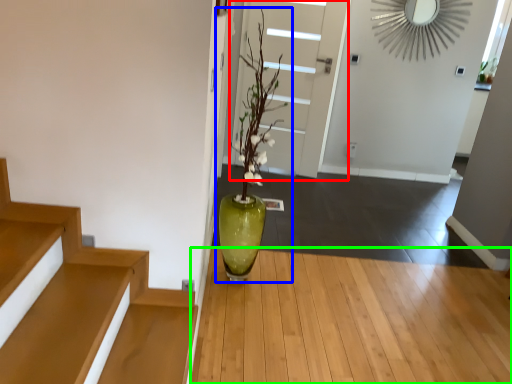
Question: Which is nearer to the door (highlighted by a red box)? houseplant (highlighted by a blue box) or hardwood (highlighted by a green box).

Choices:
 (A) houseplant
 (B) hardwood

Answer: (A)